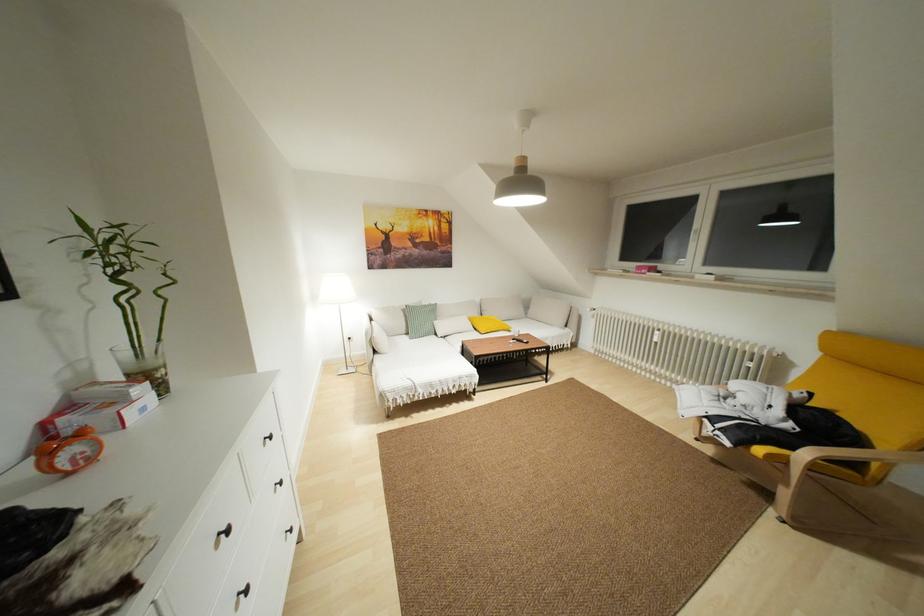
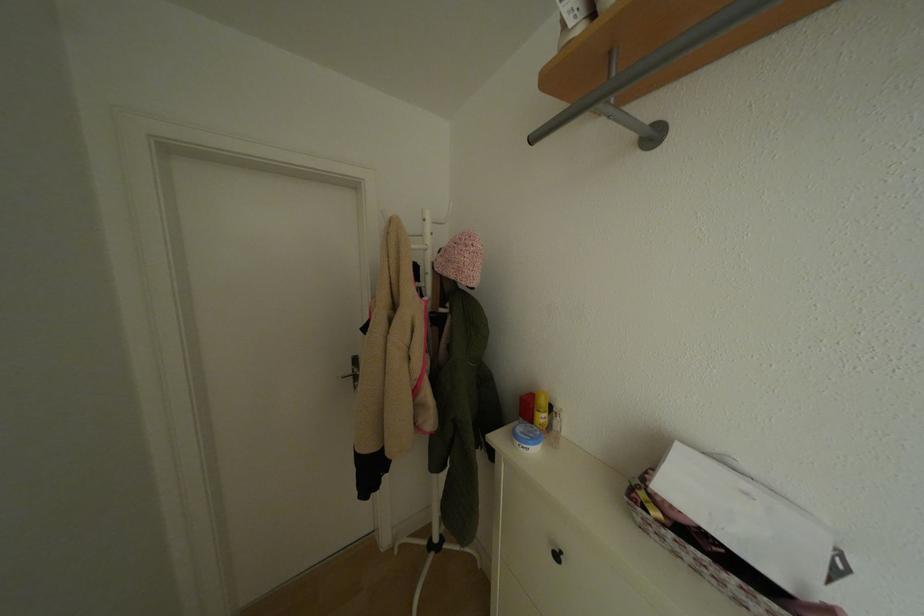
What movement of the cameraman would produce the second image?

The cameraman moved toward left, backward.